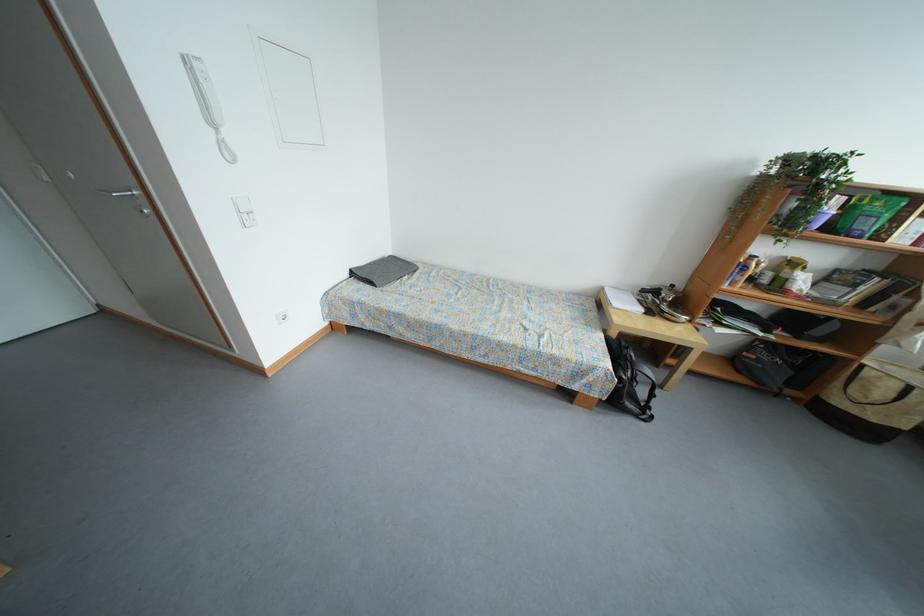
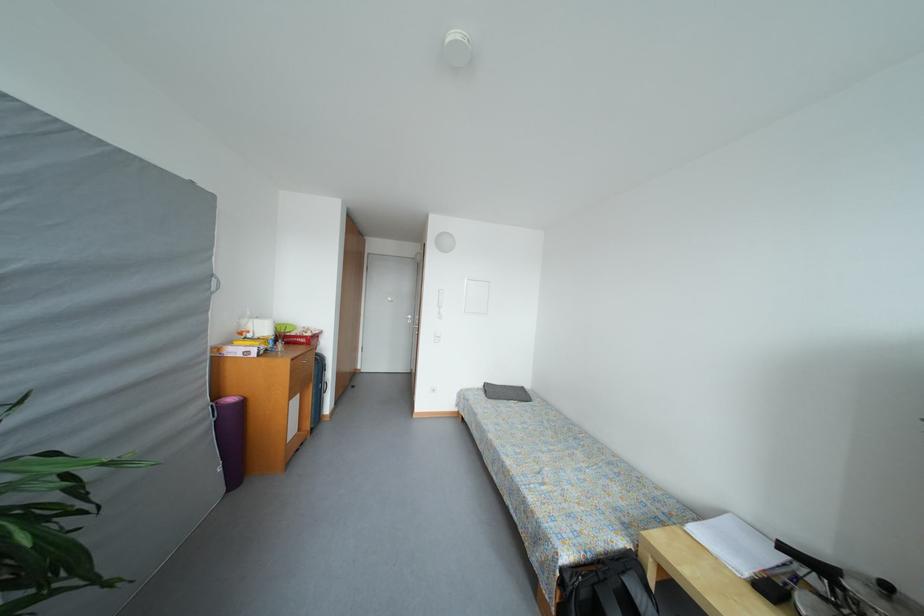
Locate, in the second image, the point that corresponds to pixel 460 331 in the first image.

(496, 440)